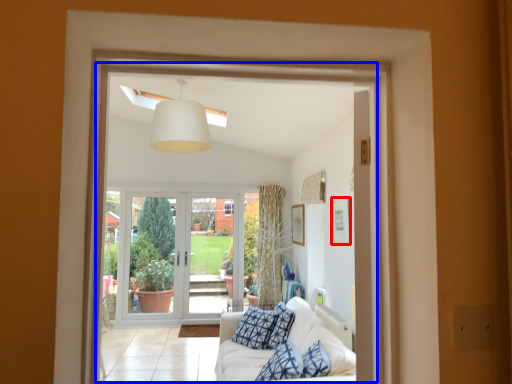
Question: Which object appears closest to the camera in this image, picture frame (highlighted by a red box) or window frame (highlighted by a blue box)?

Choices:
 (A) picture frame
 (B) window frame

Answer: (B)